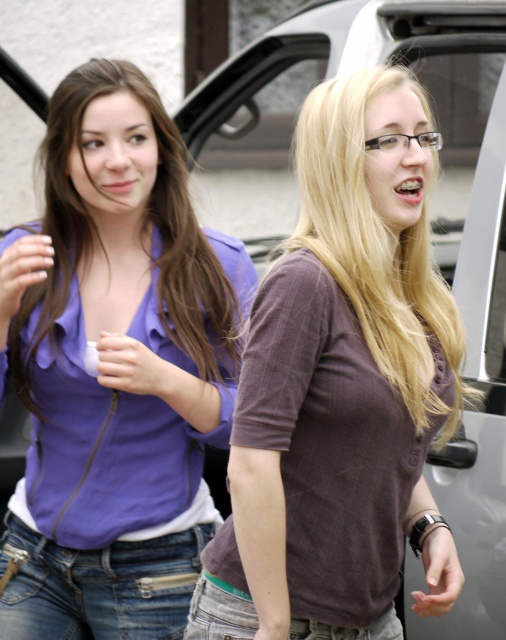
Question: Is matte purple blouse at center in front of denim jeans at lower center?

Choices:
 (A) no
 (B) yes

Answer: (B)

Question: Is matte purple blouse at center positioned at the back of jeans at lower left?

Choices:
 (A) no
 (B) yes

Answer: (A)

Question: Which is farther from the purple satin blouse at upper left?

Choices:
 (A) matte purple blouse at center
 (B) jeans at lower left

Answer: (A)

Question: Which point is closer to the camera?

Choices:
 (A) (244, 621)
 (B) (428, 108)
 (C) (195, 552)
 (D) (158, 221)

Answer: (A)

Question: Is matte purple blouse at center wider than denim jeans at lower center?

Choices:
 (A) no
 (B) yes

Answer: (A)

Question: Which of the following is the closest to the observer?

Choices:
 (A) (147, 632)
 (B) (20, 321)
 (C) (404, 403)

Answer: (C)